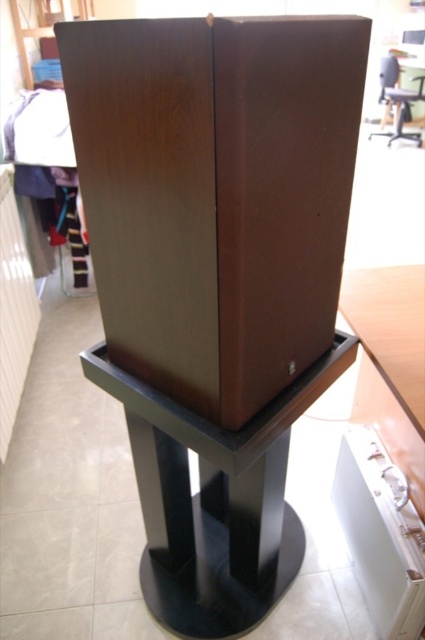
You are setting up a home theater system and need to place a 1.2 meter wide amplifier between the wooden speaker at center and the black matte table at center. Based on the scene, will the space between them accommodate the amplifier?

The wooden speaker at center has a lesser width compared to black matte table at center, so the space between them may be sufficient to place the 1.2 meter wide amplifier. However, without exact distance measurements, it is recommended to check the available space physically before placing the amplifier.

You are setting up a home theater system and need to place a new remote control on the surface closest to you. Given the wooden speaker at center and the black matte table at center, which object should you place the remote control on?

The wooden speaker at center is in front of the black matte table at center, so the remote control should be placed on the wooden speaker at center since it is closer to you.

You are setting up a home theater system and need to place a new device between the wooden speaker at center and the black matte table at center. Based on their positions, which side should you place the device to ensure it is between them?

You should place the device to the right of the wooden speaker at center since it is to the left of the black matte table at center, so placing it to the right of the wooden speaker at center would position it between them.